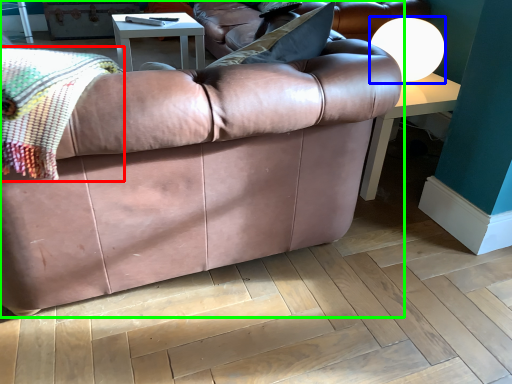
Question: Which is nearer to the blanket (highlighted by a red box)? lamp (highlighted by a blue box) or studio couch (highlighted by a green box).

Choices:
 (A) lamp
 (B) studio couch

Answer: (B)